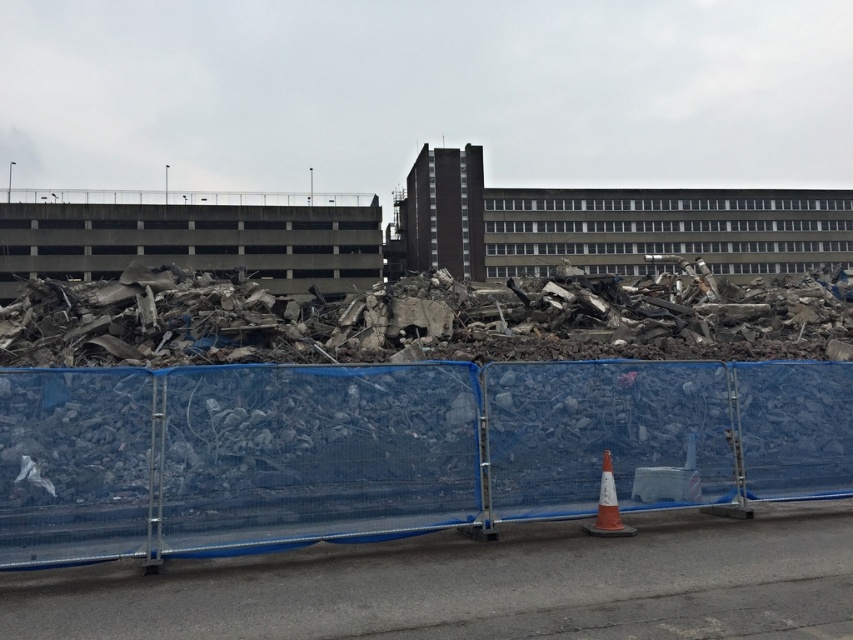
Between point (512, 380) and point (601, 518), which one is positioned in front?

Point (601, 518) is more forward.

Does blue mesh fence at center have a smaller size compared to orange reflective cone at lower center?

Correct, blue mesh fence at center occupies less space than orange reflective cone at lower center.

Is point (109, 536) farther from camera compared to point (606, 452)?

No, it is not.

The image size is (853, 640). I want to click on blue mesh fence at center, so click(393, 449).